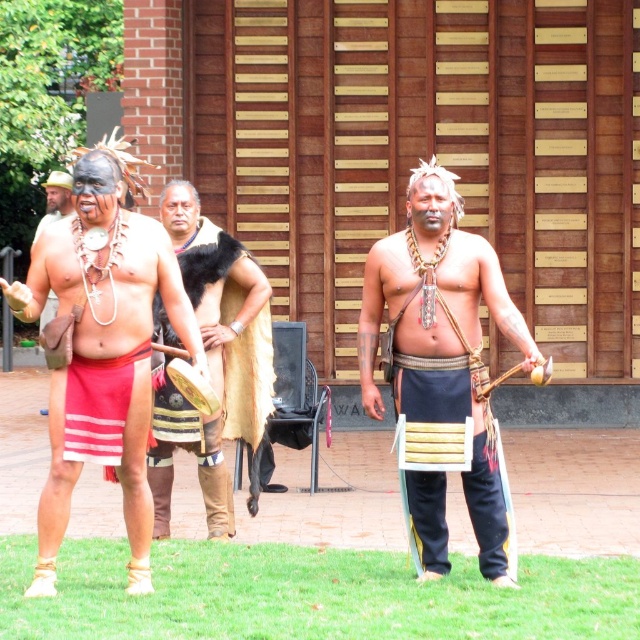
Question: Does brown leather drum at center come behind red striped cloth at center?

Choices:
 (A) yes
 (B) no

Answer: (A)

Question: Where is wooden planks at center located in relation to red striped cloth at center in the image?

Choices:
 (A) left
 (B) right

Answer: (B)

Question: Does brown leather drum at center lie in front of red striped cloth at center?

Choices:
 (A) yes
 (B) no

Answer: (B)

Question: Which of the following is the farthest from the observer?

Choices:
 (A) matte black loincloth at center
 (B) matte black headdress at left
 (C) wooden planks at center
 (D) brown leather drum at center

Answer: (D)

Question: Which point is closer to the camera?

Choices:
 (A) matte black loincloth at center
 (B) brown leather drum at center
 (C) red striped cloth at center

Answer: (A)

Question: Which object is the farthest from the red striped cloth at center?

Choices:
 (A) brown leather drum at center
 (B) matte black loincloth at center
 (C) matte black headdress at left
 (D) wooden planks at center

Answer: (D)